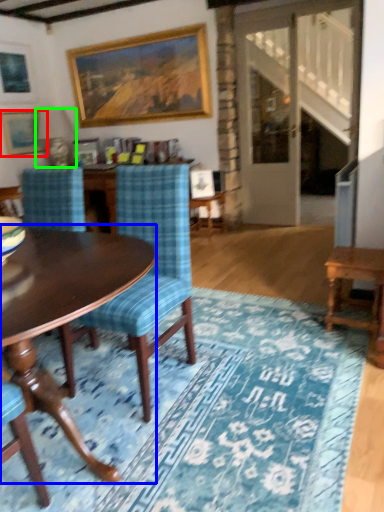
Question: Which object is positioned closest to picture frame (highlighted by a red box)? Select from coffee table (highlighted by a blue box) and lamp (highlighted by a green box).

Choices:
 (A) coffee table
 (B) lamp

Answer: (B)